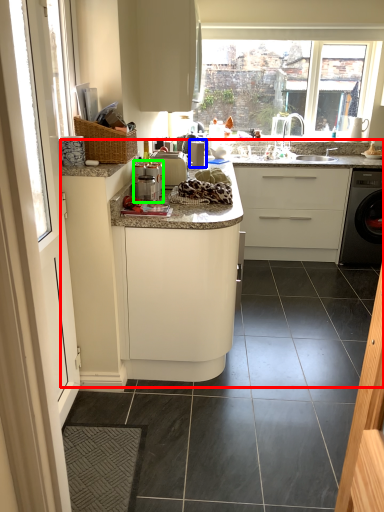
Question: Considering the real-world distances, which object is farthest from counter top (highlighted by a red box)? appliance (highlighted by a blue box) or coffee machine (highlighted by a green box)?

Choices:
 (A) appliance
 (B) coffee machine

Answer: (B)